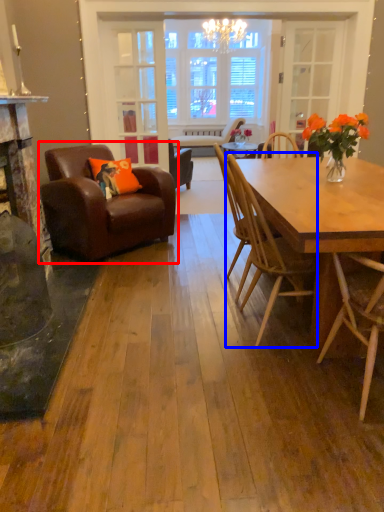
Question: Which of the following is the closest to the observer, chair (highlighted by a red box) or chair (highlighted by a blue box)?

Choices:
 (A) chair
 (B) chair

Answer: (B)